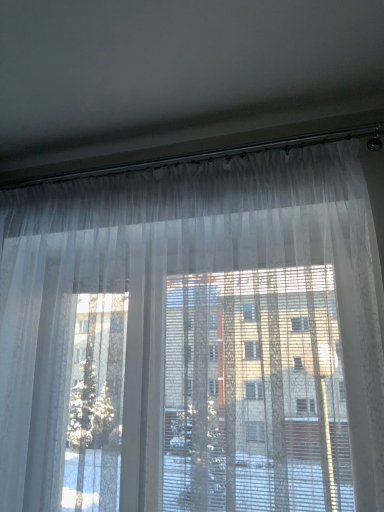
Question: Should I look upward or downward to see sheer white curtain at center?

Choices:
 (A) up
 (B) down

Answer: (B)